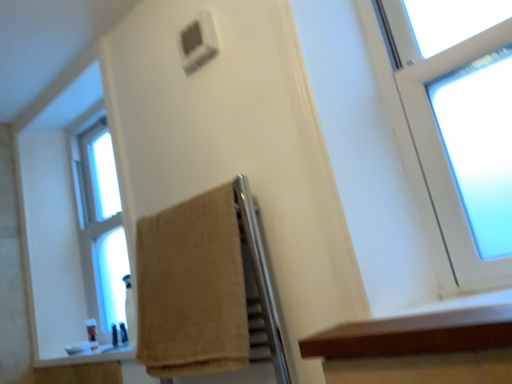
Question: Does clear glass window at left appear on the left side of beige cotton towel at center?

Choices:
 (A) no
 (B) yes

Answer: (B)

Question: Is clear glass window at left touching beige cotton towel at center?

Choices:
 (A) no
 (B) yes

Answer: (A)

Question: Can beige cotton towel at center be found inside clear glass window at left?

Choices:
 (A) no
 (B) yes

Answer: (A)

Question: From a real-world perspective, is clear glass window at left positioned under beige cotton towel at center based on gravity?

Choices:
 (A) no
 (B) yes

Answer: (A)

Question: Is clear glass window at left bigger than beige cotton towel at center?

Choices:
 (A) yes
 (B) no

Answer: (A)

Question: Is clear glass window at left not near beige cotton towel at center?

Choices:
 (A) yes
 (B) no

Answer: (B)

Question: Is translucent plastic soap at lower left positioned behind brown wood ledge at lower right?

Choices:
 (A) no
 (B) yes

Answer: (B)

Question: Considering the relative sizes of translucent plastic soap at lower left and brown wood ledge at lower right in the image provided, is translucent plastic soap at lower left wider than brown wood ledge at lower right?

Choices:
 (A) yes
 (B) no

Answer: (B)

Question: Can brown wood ledge at lower right be found inside translucent plastic soap at lower left?

Choices:
 (A) yes
 (B) no

Answer: (B)

Question: Is brown wood ledge at lower right at the back of translucent plastic soap at lower left?

Choices:
 (A) no
 (B) yes

Answer: (A)

Question: Is translucent plastic soap at lower left positioned before brown wood ledge at lower right?

Choices:
 (A) no
 (B) yes

Answer: (A)

Question: Are translucent plastic soap at lower left and brown wood ledge at lower right located far from each other?

Choices:
 (A) no
 (B) yes

Answer: (B)

Question: From a real-world perspective, is clear glass window at left on top of translucent plastic soap at lower left?

Choices:
 (A) yes
 (B) no

Answer: (A)